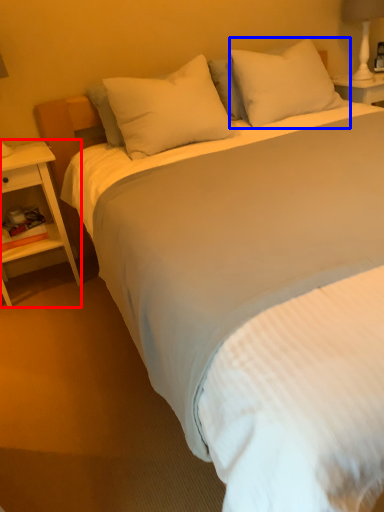
Question: Which of the following is the farthest to the observer, nightstand (highlighted by a red box) or pillow (highlighted by a blue box)?

Choices:
 (A) nightstand
 (B) pillow

Answer: (B)